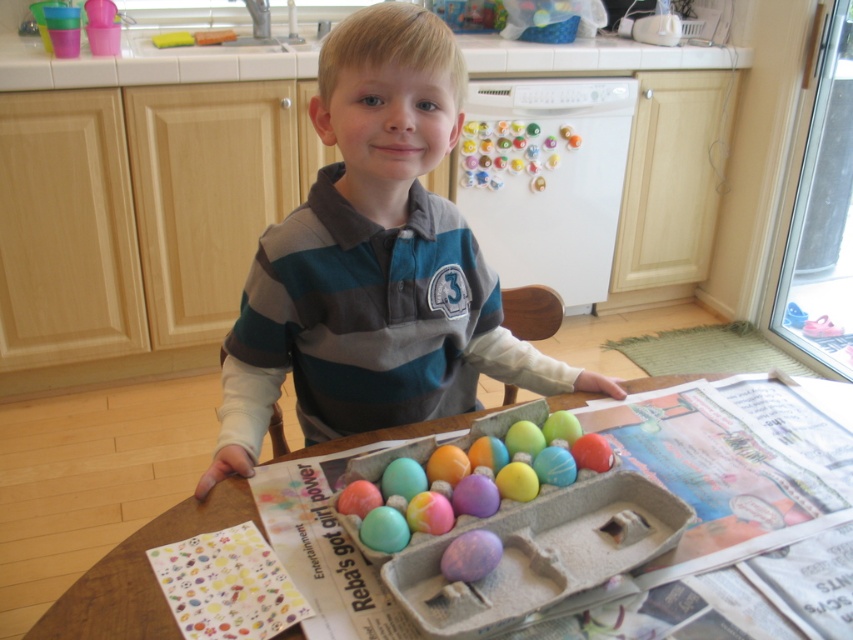
Does pastel matte eggs at center have a greater height compared to cardboard tray at center?

No, pastel matte eggs at center is not taller than cardboard tray at center.

Where is `pastel matte eggs at center`? The width and height of the screenshot is (853, 640). pastel matte eggs at center is located at coordinates (469, 476).

In order to click on pastel matte eggs at center in this screenshot , I will do `click(469, 476)`.

Is striped cotton shirt at center bigger than cardboard tray at center?

Indeed, striped cotton shirt at center has a larger size compared to cardboard tray at center.

Where is `striped cotton shirt at center`? striped cotton shirt at center is located at coordinates (374, 262).

This screenshot has width=853, height=640. I want to click on striped cotton shirt at center, so click(x=374, y=262).

Does striped cotton shirt at center appear over pastel matte eggs at center?

Yes.

Which is more to the right, striped cotton shirt at center or pastel matte eggs at center?

pastel matte eggs at center is more to the right.

Where is `striped cotton shirt at center`? striped cotton shirt at center is located at coordinates (374, 262).